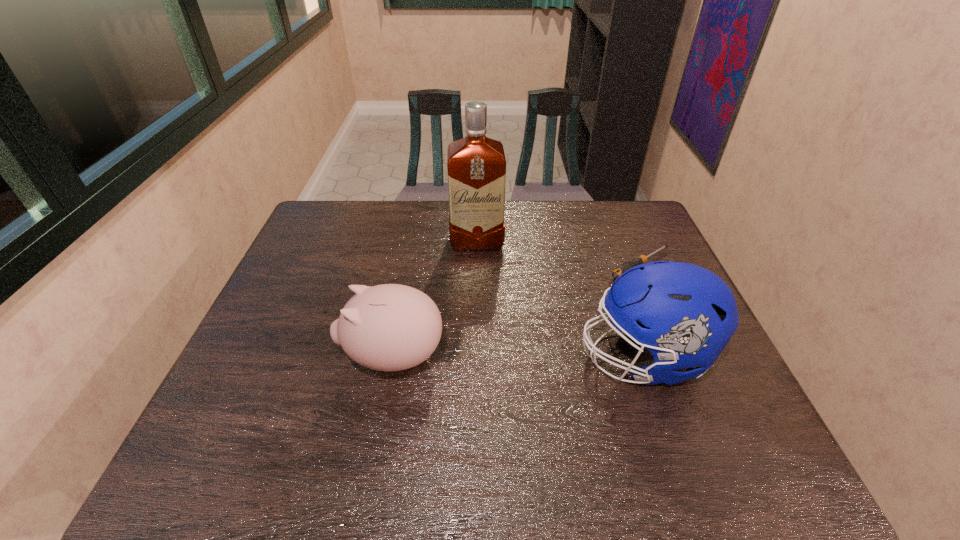
Find the location of a particular element. This screenshot has width=960, height=540. the third tallest object is located at coordinates (390, 327).

In order to click on the second tallest object in this screenshot , I will do `click(683, 314)`.

I want to click on liquor, so (x=476, y=164).

The image size is (960, 540). I want to click on the shortest object, so click(642, 259).

Find the location of a particular element. Image resolution: width=960 pixels, height=540 pixels. vacant space located at the snout of the third tallest object is located at coordinates (282, 357).

Identify the location of free space located at the snout of the third tallest object. (266, 357).

Locate an element on the screen. The height and width of the screenshot is (540, 960). free point located 0.210m at the snout of the third tallest object is located at coordinates (253, 357).

The width and height of the screenshot is (960, 540). In order to click on free space located 0.050m on the face guard of the football helmet in this screenshot , I will do coord(558,357).

This screenshot has width=960, height=540. I want to click on free space located on the face guard of the football helmet, so click(475, 357).

Find the location of a particular element. vacant space located on the face guard of the football helmet is located at coordinates (463, 357).